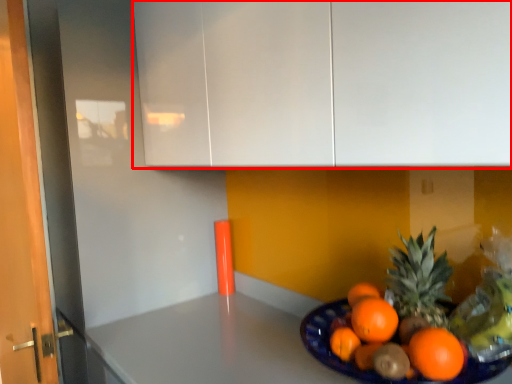
Question: Considering the relative positions of cabinetry (annotated by the red box) and counter top in the image provided, where is cabinetry (annotated by the red box) located with respect to the staircase?

Choices:
 (A) right
 (B) left

Answer: (B)